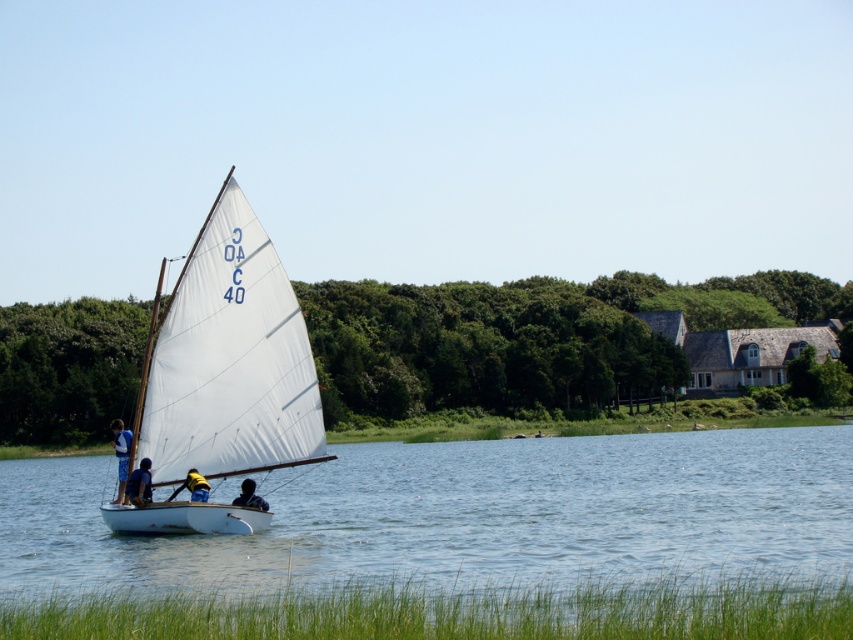
Question: Is yellow fabric at center wider than dark blue fabric shirt at lower center?

Choices:
 (A) yes
 (B) no

Answer: (A)

Question: Which of the following is the closest to the observer?

Choices:
 (A) blue fabric shirt at lower left
 (B) clear blue water at center
 (C) dark blue fabric shirt at lower center
 (D) yellow fabric at center

Answer: (B)

Question: Is blue fabric shirt at lower left above yellow fabric at center?

Choices:
 (A) yes
 (B) no

Answer: (A)

Question: Considering the real-world distances, which object is closest to the dark blue fabric shirt at lower center?

Choices:
 (A) white matte sailboat at center
 (B) yellow fabric at center
 (C) blue fabric life vest at center

Answer: (B)

Question: From the image, what is the correct spatial relationship of yellow fabric at center in relation to dark blue fabric shirt at lower center?

Choices:
 (A) above
 (B) below

Answer: (A)

Question: Which object appears farthest from the camera in this image?

Choices:
 (A) yellow fabric at center
 (B) white matte sailboat at center
 (C) dark blue fabric shirt at lower center
 (D) blue fabric shirt at lower left

Answer: (C)